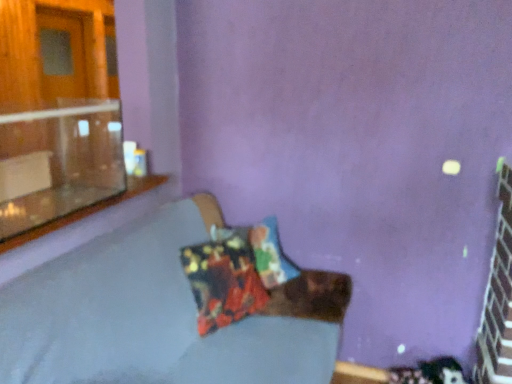
Question: Considering their positions, is textured fabric couch at center located in front of or behind clear glass window sill at upper left?

Choices:
 (A) front
 (B) behind

Answer: (A)

Question: Looking at the image, does textured fabric couch at center seem bigger or smaller compared to clear glass window sill at upper left?

Choices:
 (A) big
 (B) small

Answer: (A)

Question: Which object is the farthest from the clear glass window sill at upper left?

Choices:
 (A) transparent glass window at upper left
 (B) textured fabric couch at center
 (C) printed fabric pillow at center

Answer: (C)

Question: Which of these objects is positioned farthest from the transparent glass window at upper left?

Choices:
 (A) printed fabric pillow at center
 (B) clear glass window sill at upper left
 (C) textured fabric couch at center

Answer: (A)